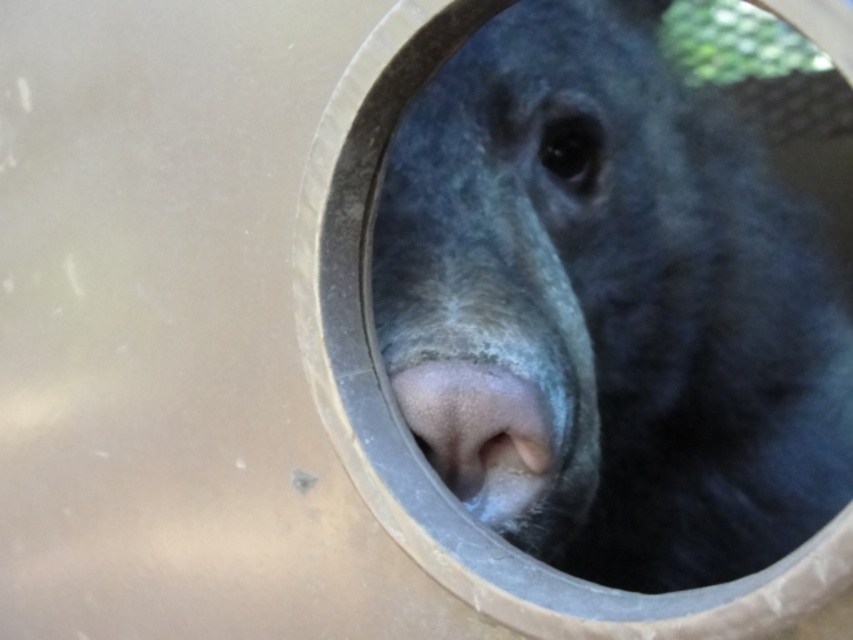
Consider the image. You are a wildlife photographer aiming to capture the fuzzy black bear at center in the center of your photo. Based on its current position at point coordinates, is the bear already centered in the frame?

The fuzzy black bear at center is already positioned at coordinates point (608,307), which is very close to the center of the frame, so yes, it is considered centered.

You are an animal researcher observing a bear through a circular opening. The opening is framed by a light brown structure. You notice a point marked at coordinates (608, 307). What animal is located at that point?

The point at coordinates (608, 307) has the fuzzy black bear at center.

You are an animal researcher observing a bear through a circular opening. You notice the fuzzy black bear at center and the gray matte nose at center. Which object is closer to the opening based on their positions?

The fuzzy black bear at center is positioned over the gray matte nose at center, meaning the fuzzy black bear at center is closer to the opening.